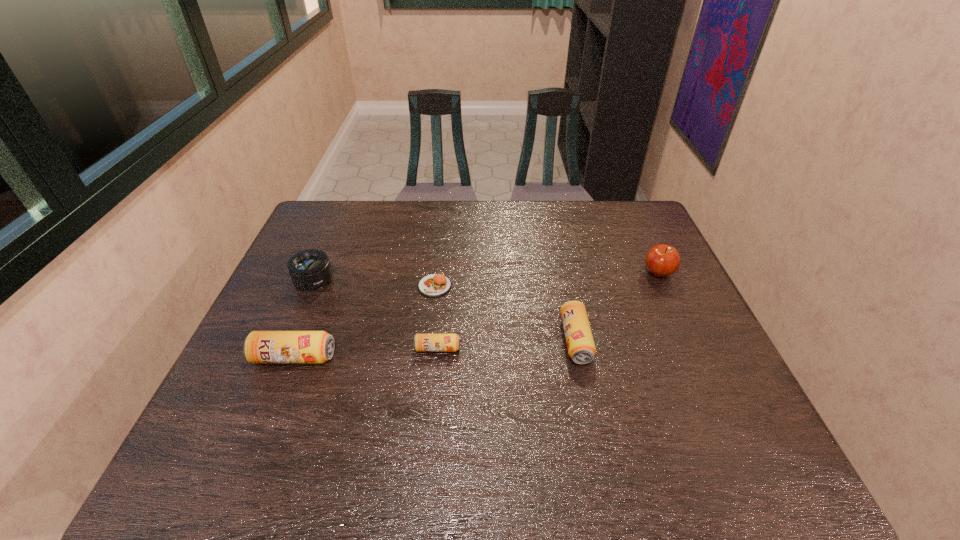
This screenshot has height=540, width=960. Find the location of `vacant space at the left edge`. vacant space at the left edge is located at coordinates (287, 273).

The image size is (960, 540). In order to click on free region at the right edge in this screenshot , I will do `click(637, 242)`.

Identify the location of vacant space at the far left corner of the desktop. This screenshot has height=540, width=960. (327, 239).

Identify the location of free space that is in between the second beer can from left to right and the apple. (x=548, y=311).

Locate an element on the screen. The image size is (960, 540). free point between the second beer can from right to left and the rightmost beer can is located at coordinates (507, 344).

Where is `empty location between the telephoto lens and the shortest beer can`? This screenshot has width=960, height=540. empty location between the telephoto lens and the shortest beer can is located at coordinates (375, 315).

This screenshot has width=960, height=540. I want to click on blank region between the second beer can from left to right and the rightmost object, so click(548, 311).

Identify the location of free space between the shortest object and the shortest beer can. (436, 318).

Where is `vacant point located between the rightmost object and the second tallest beer can`? The image size is (960, 540). vacant point located between the rightmost object and the second tallest beer can is located at coordinates (x=617, y=307).

Image resolution: width=960 pixels, height=540 pixels. I want to click on unoccupied area between the leftmost beer can and the fifth tallest object, so click(366, 353).